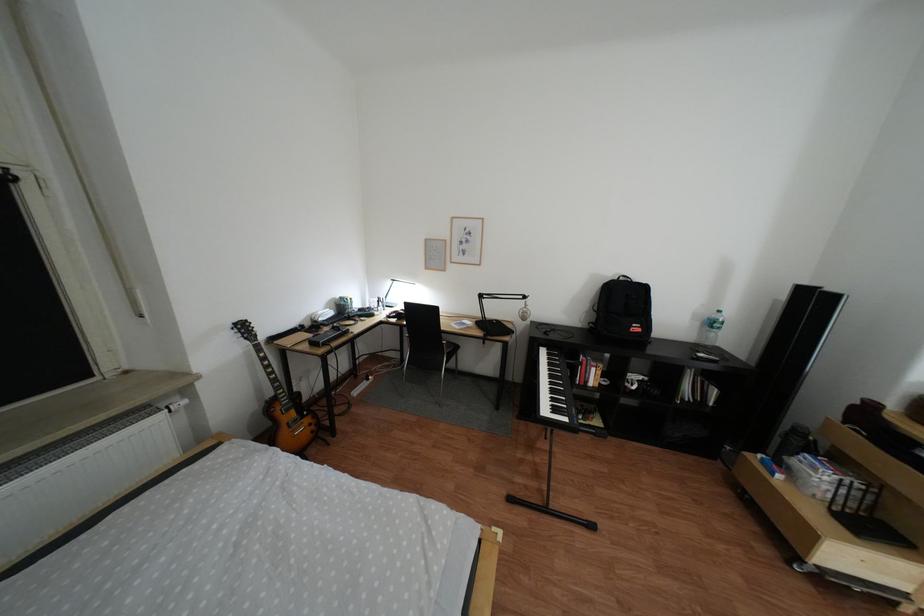
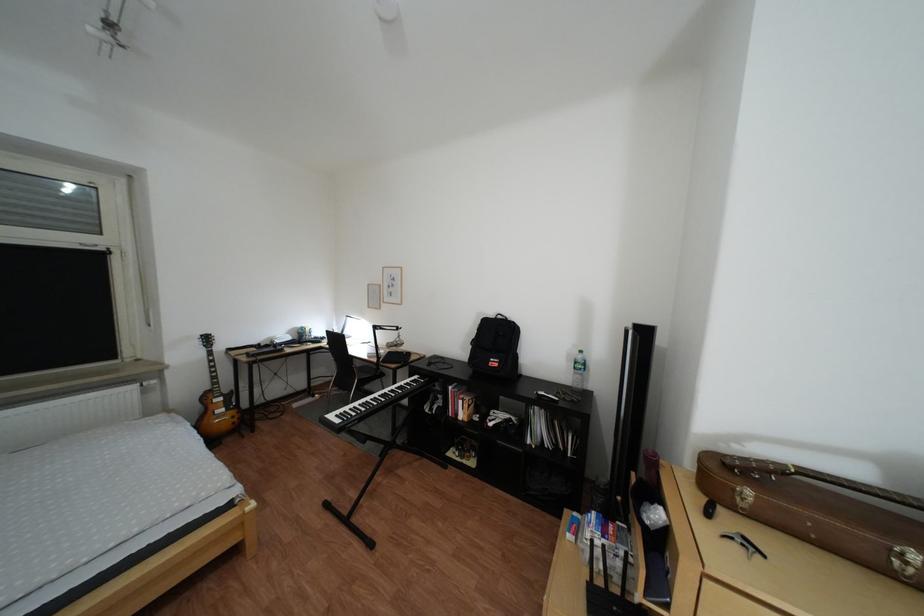
In the second image, find the point that corresponds to pixel 651 329 in the first image.

(509, 363)